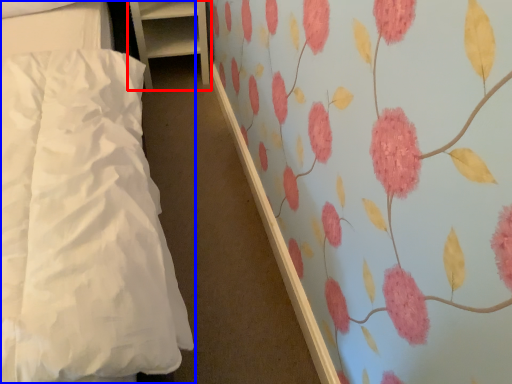
Question: Which point is closer to the camera, furniture (highlighted by a red box) or bed (highlighted by a blue box)?

Choices:
 (A) furniture
 (B) bed

Answer: (B)